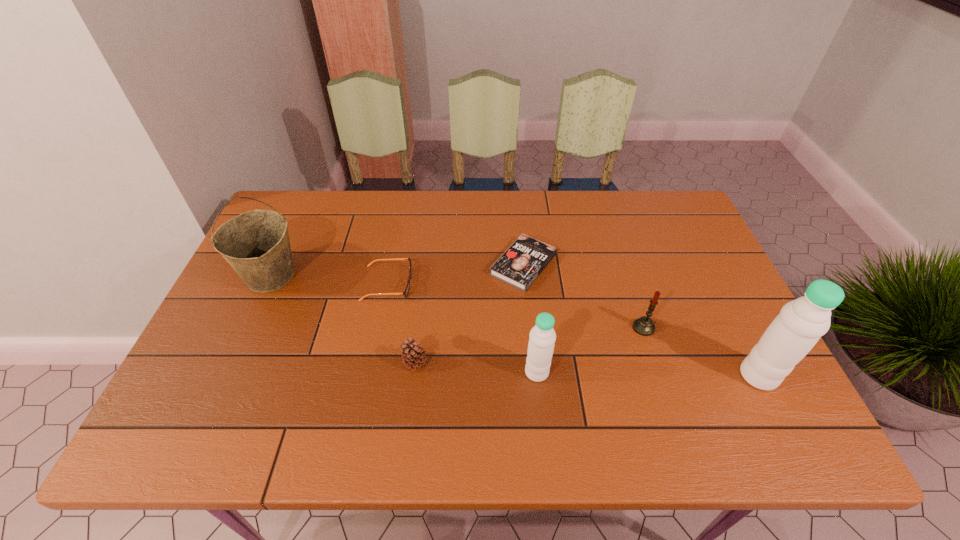
The width and height of the screenshot is (960, 540). What are the coordinates of `the shorter water bottle` in the screenshot? It's located at (542, 337).

Locate an element on the screen. The image size is (960, 540). the third tallest object is located at coordinates (542, 337).

At what (x,y) coordinates should I click in order to perform the action: click on the rightmost object. Please return your answer as a coordinate pair (x, y). The image size is (960, 540). Looking at the image, I should click on (793, 333).

This screenshot has width=960, height=540. In order to click on the right water bottle in this screenshot , I will do `click(793, 333)`.

Image resolution: width=960 pixels, height=540 pixels. Find the location of `the second object from left to right`. the second object from left to right is located at coordinates (406, 291).

Where is `spectacles`? spectacles is located at coordinates (406, 291).

Where is `book`? book is located at coordinates (526, 258).

Find the location of a particular element. Image resolution: width=960 pixels, height=540 pixels. the fourth nearest object is located at coordinates (644, 326).

Find the location of a particular element. The image size is (960, 540). the sixth object from left to right is located at coordinates click(x=644, y=326).

Locate an element on the screen. This screenshot has width=960, height=540. the leftmost object is located at coordinates (256, 244).